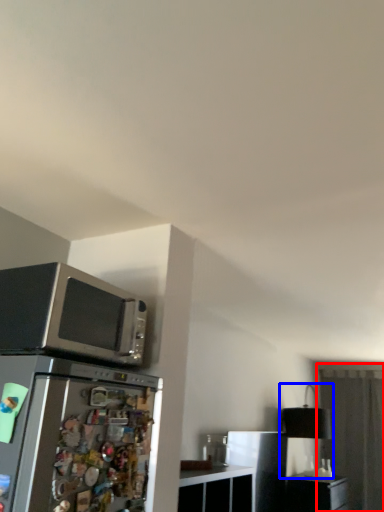
Question: Which point is closer to the camera, glass door (highlighted by a red box) or lamp (highlighted by a blue box)?

Choices:
 (A) glass door
 (B) lamp

Answer: (B)